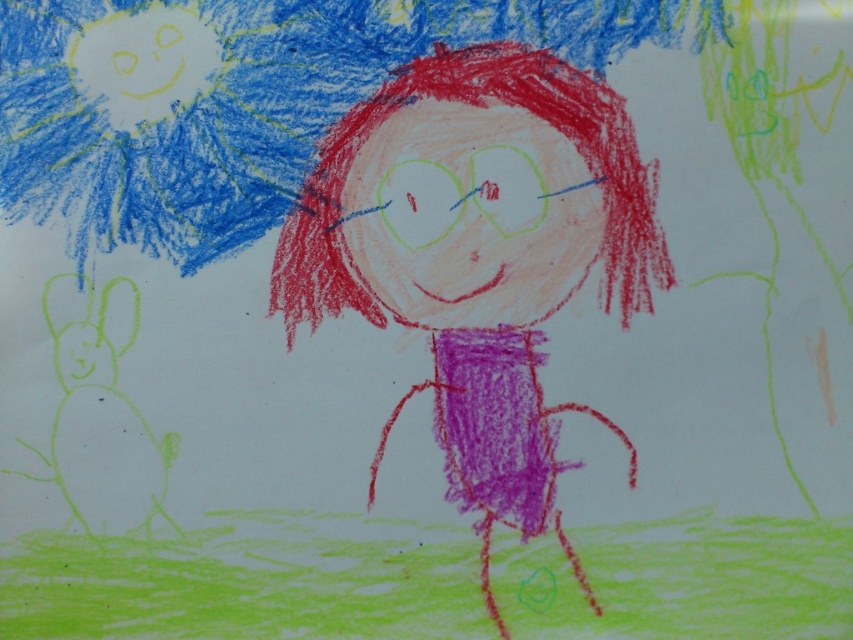
Question: Among these objects, which one is farthest from the camera?

Choices:
 (A) blue textured umbrella at upper left
 (B) smooth purple dress at center

Answer: (B)

Question: Among these objects, which one is farthest from the camera?

Choices:
 (A) blue textured umbrella at upper left
 (B) smooth purple dress at center

Answer: (B)

Question: Is smooth purple dress at center below blue textured umbrella at upper left?

Choices:
 (A) yes
 (B) no

Answer: (A)

Question: Does smooth purple dress at center appear under blue textured umbrella at upper left?

Choices:
 (A) no
 (B) yes

Answer: (B)

Question: Does smooth purple dress at center have a larger size compared to blue textured umbrella at upper left?

Choices:
 (A) yes
 (B) no

Answer: (A)